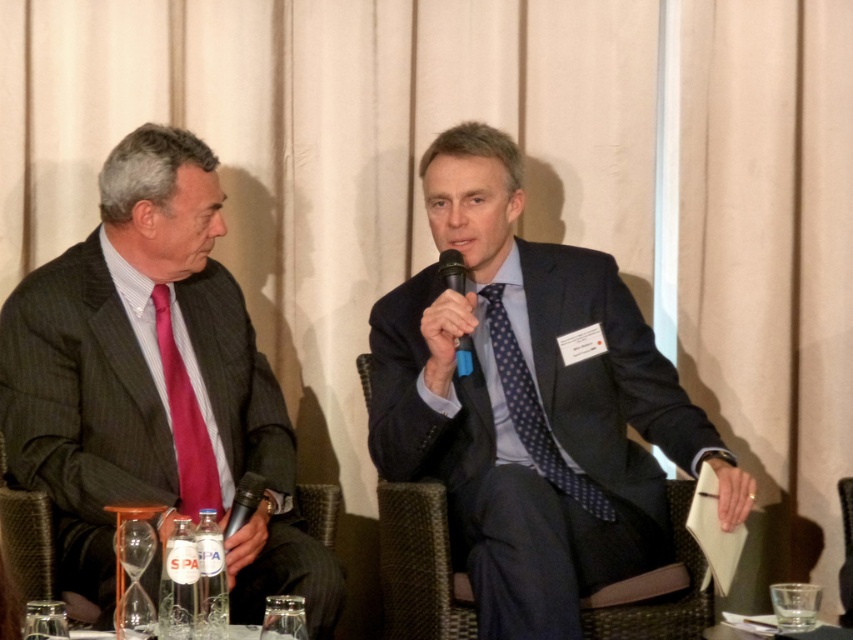
Question: Which of these objects is positioned farthest from the woven dark brown chair at center?

Choices:
 (A) clear glass at lower right
 (B) matte black suit at left
 (C) matte red tie at left
 (D) blue dotted tie at center

Answer: (A)

Question: Which point appears closest to the camera in this image?

Choices:
 (A) (733, 625)
 (B) (422, 540)
 (C) (527, 426)

Answer: (A)

Question: Which of the following is the farthest from the observer?

Choices:
 (A) clear glass at lower right
 (B) blue dotted tie at center
 (C) matte black suit at left
 (D) woven dark brown chair at center

Answer: (B)

Question: Can you confirm if matte black suit at left is positioned above blue dotted tie at center?

Choices:
 (A) no
 (B) yes

Answer: (B)

Question: Is woven dark brown chair at center to the right of matte red tie at left from the viewer's perspective?

Choices:
 (A) yes
 (B) no

Answer: (A)

Question: Can you confirm if woven dark brown chair at center is positioned above matte red tie at left?

Choices:
 (A) yes
 (B) no

Answer: (B)